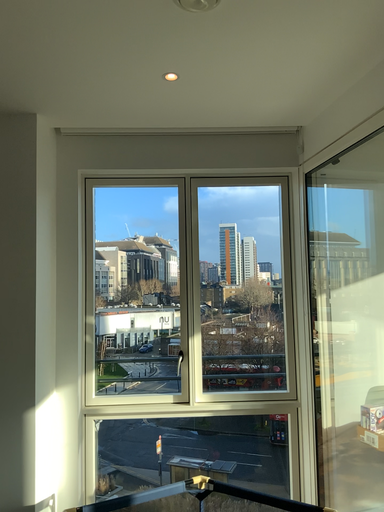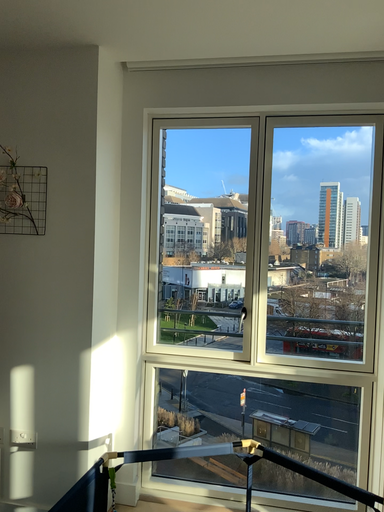
Question: Which way did the camera rotate in the video?

Choices:
 (A) rotated left
 (B) rotated right

Answer: (A)